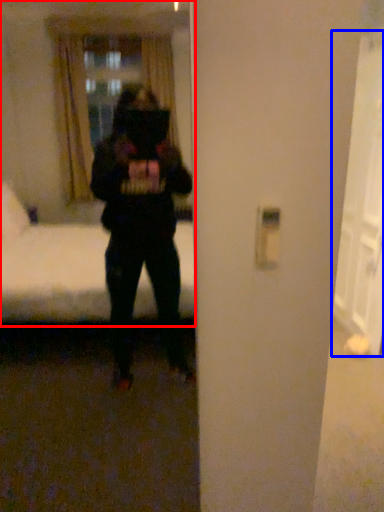
Question: Among these objects, which one is nearest to the camera, mirror (highlighted by a red box) or glass door (highlighted by a blue box)?

Choices:
 (A) mirror
 (B) glass door

Answer: (A)